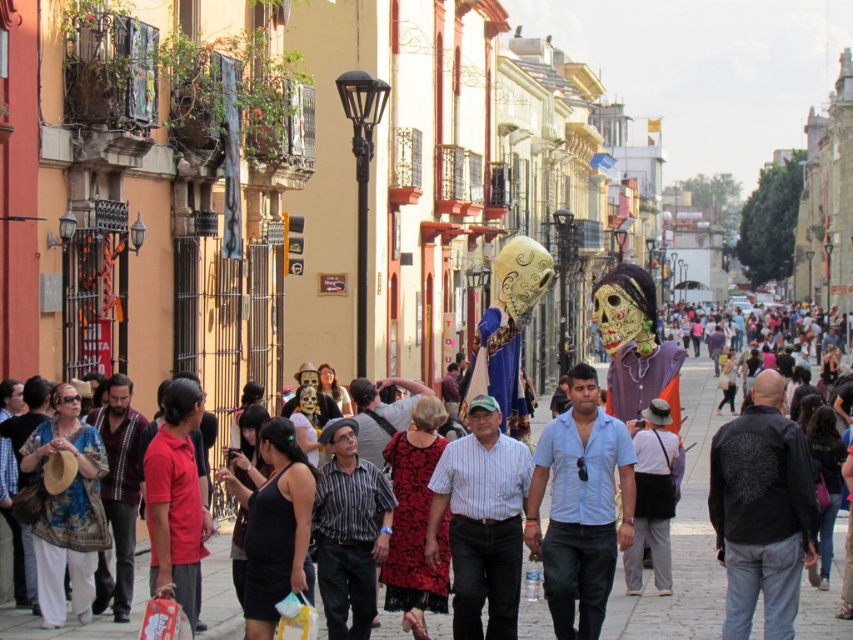
Is the position of black matte tank top at center less distant than that of gray cotton pants at center?

Yes, it is.

Which is above, black matte tank top at center or gray cotton pants at center?

Positioned higher is black matte tank top at center.

What do you see at coordinates (274, 525) in the screenshot? The width and height of the screenshot is (853, 640). I see `black matte tank top at center` at bounding box center [274, 525].

Find the location of `black matte tank top at center`. black matte tank top at center is located at coordinates (274, 525).

Between black leather jacket at lower right and striped cotton shirt at center, which one is positioned lower?

striped cotton shirt at center is lower down.

Who is more forward, (x=723, y=499) or (x=329, y=444)?

Point (x=723, y=499)

Does point (791, 440) come farther from viewer compared to point (341, 488)?

No, it is not.

You are a GUI agent. You are given a task and a screenshot of the screen. Output one action in this format:
    pyautogui.click(x=<x>, y=<y>)
    Task: Click on the black leather jacket at lower right
    
    Given the screenshot: What is the action you would take?
    pyautogui.click(x=762, y=512)

What do you see at coordinates (682, 538) in the screenshot?
I see `paved stone street at center` at bounding box center [682, 538].

Is paved stone street at center above denim jacket at lower right?

No.

Is point (694, 452) more distant than point (846, 608)?

Yes, point (694, 452) is behind point (846, 608).

Identify the location of paved stone street at center. The image size is (853, 640). (682, 538).